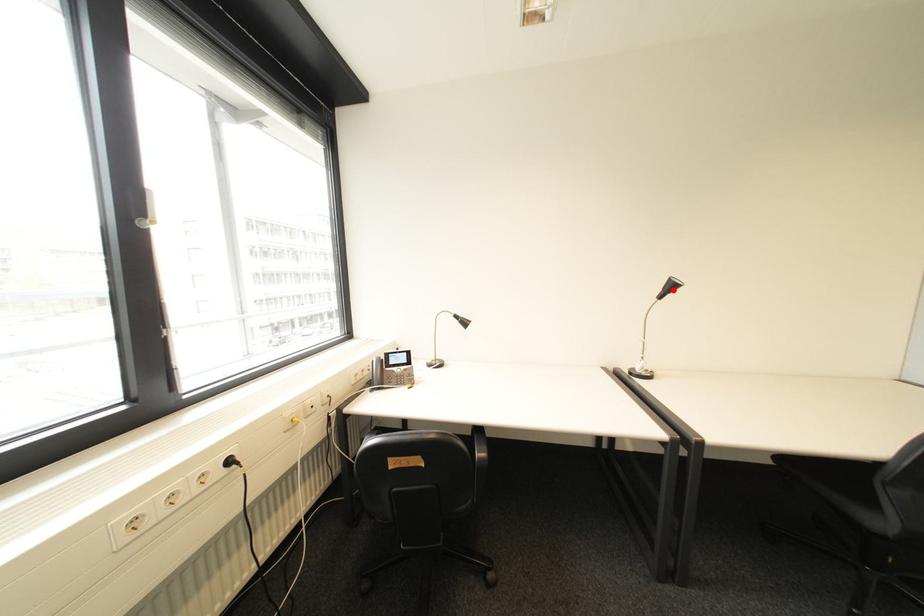
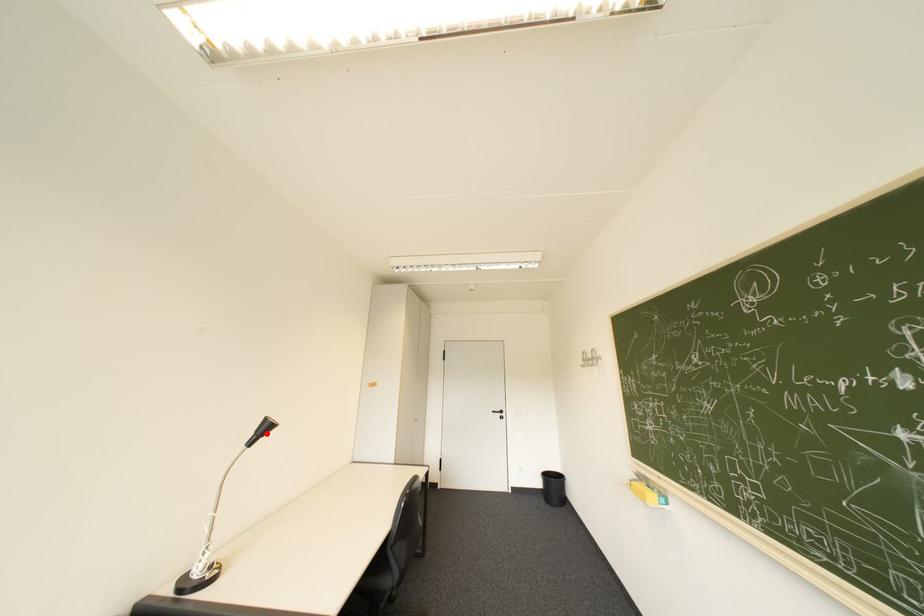
I am providing you with two images of the same scene from different viewpoints. A red point is marked on the first image and another point is marked on the second image. Does the point marked in image1 correspond to the same location as the one in image2?

Yes